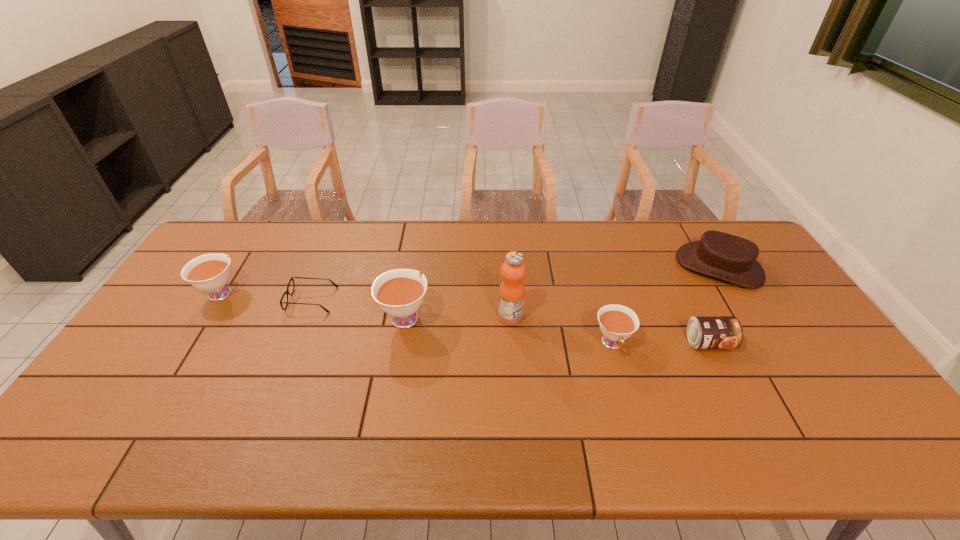
I want to click on blank space located with the lenses facing outward on the spectacles, so click(x=438, y=300).

Locate an element on the screen. free point located 0.120m on the front label of the can is located at coordinates (733, 393).

I want to click on object positioned at the far edge, so 717,254.

At what (x,y) coordinates should I click in order to perform the action: click on object located in the left edge section of the desktop. Please return your answer as a coordinate pair (x, y). Looking at the image, I should click on (210, 272).

You are a GUI agent. You are given a task and a screenshot of the screen. Output one action in this format:
    pyautogui.click(x=<x>, y=<y>)
    Task: Click on the object at the right edge
    
    Given the screenshot: What is the action you would take?
    pyautogui.click(x=717, y=254)

Where is `object situated at the far right corner`? Image resolution: width=960 pixels, height=540 pixels. object situated at the far right corner is located at coordinates (717, 254).

In the image, there is a desktop. Where is `vacant space at the far edge`? vacant space at the far edge is located at coordinates (300, 250).

Where is `free space at the near edge of the desktop`? The height and width of the screenshot is (540, 960). free space at the near edge of the desktop is located at coordinates [362, 396].

This screenshot has width=960, height=540. I want to click on vacant area at the left edge of the desktop, so click(143, 334).

You are a GUI agent. You are given a task and a screenshot of the screen. Output one action in this format:
    pyautogui.click(x=<x>, y=<y>)
    Task: Click on the vacant area at the near right corner
    This screenshot has height=540, width=960.
    Given the screenshot: What is the action you would take?
    pyautogui.click(x=829, y=405)